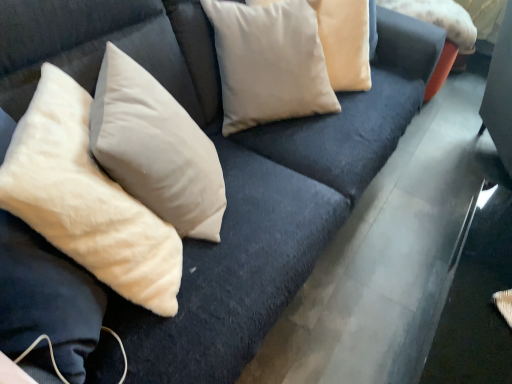
Question: Is beige cotton pillow at upper right, the fourth pillow when ordered from left to right, further to camera compared to beige soft pillow at left, the 4th pillow viewed from the right?

Choices:
 (A) yes
 (B) no

Answer: (A)

Question: Considering the relative sizes of beige cotton pillow at upper right, the first pillow from the right, and beige soft pillow at left, the first pillow from the left, in the image provided, is beige cotton pillow at upper right, the first pillow from the right, bigger than beige soft pillow at left, the first pillow from the left,?

Choices:
 (A) yes
 (B) no

Answer: (B)

Question: Is beige cotton pillow at upper right, the fourth pillow when ordered from left to right, looking in the opposite direction of beige soft pillow at left, the 4th pillow viewed from the right?

Choices:
 (A) yes
 (B) no

Answer: (B)

Question: Does beige cotton pillow at upper right, the first pillow from the right, have a smaller size compared to beige soft pillow at left, the 4th pillow viewed from the right?

Choices:
 (A) no
 (B) yes

Answer: (B)

Question: Considering the relative sizes of beige cotton pillow at upper right, the fourth pillow when ordered from left to right, and beige soft pillow at left, the 4th pillow viewed from the right, in the image provided, is beige cotton pillow at upper right, the fourth pillow when ordered from left to right, thinner than beige soft pillow at left, the 4th pillow viewed from the right,?

Choices:
 (A) no
 (B) yes

Answer: (B)

Question: Is beige velvet pillow at upper center, the 2th pillow viewed from the left, taller or shorter than beige cotton pillow at upper right, the first pillow from the right?

Choices:
 (A) short
 (B) tall

Answer: (B)

Question: From the image's perspective, is beige velvet pillow at upper center, acting as the 3th pillow starting from the right, positioned above or below beige cotton pillow at upper right, the fourth pillow when ordered from left to right?

Choices:
 (A) above
 (B) below

Answer: (B)

Question: Is beige velvet pillow at upper center, acting as the 3th pillow starting from the right, bigger or smaller than beige cotton pillow at upper right, the first pillow from the right?

Choices:
 (A) big
 (B) small

Answer: (A)

Question: From a real-world perspective, relative to beige cotton pillow at upper right, the fourth pillow when ordered from left to right, is beige velvet pillow at upper center, the 2th pillow viewed from the left, vertically above or below?

Choices:
 (A) above
 (B) below

Answer: (A)

Question: Looking at their shapes, would you say beige cotton pillow at upper center, which appears as the third pillow when viewed from the left, is wider or thinner than beige velvet pillow at upper center, acting as the 3th pillow starting from the right?

Choices:
 (A) wide
 (B) thin

Answer: (A)

Question: In terms of size, does beige cotton pillow at upper center, which appears as the third pillow when viewed from the left, appear bigger or smaller than beige velvet pillow at upper center, acting as the 3th pillow starting from the right?

Choices:
 (A) big
 (B) small

Answer: (A)

Question: Is beige cotton pillow at upper center, placed as the 2th pillow when sorted from right to left, to the left or to the right of beige velvet pillow at upper center, acting as the 3th pillow starting from the right, in the image?

Choices:
 (A) left
 (B) right

Answer: (B)

Question: From a real-world perspective, relative to beige velvet pillow at upper center, the 2th pillow viewed from the left, is beige cotton pillow at upper center, placed as the 2th pillow when sorted from right to left, vertically above or below?

Choices:
 (A) below
 (B) above

Answer: (A)

Question: From a real-world perspective, relative to beige cotton pillow at upper right, the fourth pillow when ordered from left to right, is beige cotton pillow at upper center, placed as the 2th pillow when sorted from right to left, vertically above or below?

Choices:
 (A) below
 (B) above

Answer: (B)

Question: Do you think beige cotton pillow at upper center, which appears as the third pillow when viewed from the left, is within beige cotton pillow at upper right, the fourth pillow when ordered from left to right, or outside of it?

Choices:
 (A) inside
 (B) outside

Answer: (B)